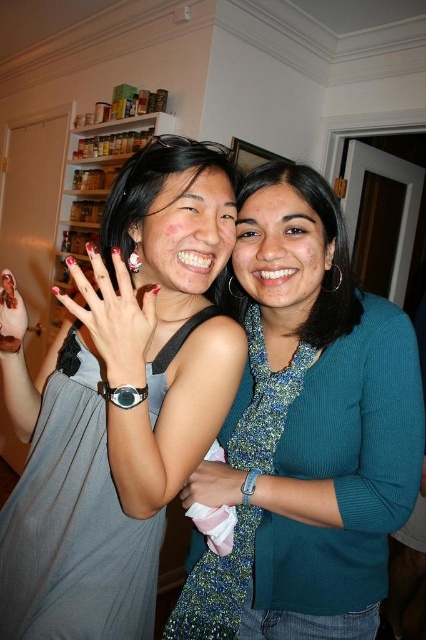
Question: Can you confirm if smooth skin face at center is positioned to the left of blue textured sweater at center?

Choices:
 (A) yes
 (B) no

Answer: (A)

Question: Can you confirm if smooth skin face at center is positioned below matte black face at center?

Choices:
 (A) yes
 (B) no

Answer: (A)

Question: Which object appears closest to the camera in this image?

Choices:
 (A) gray matte dress at center
 (B) matte black face at center
 (C) blue textured sweater at center
 (D) smooth skin face at center

Answer: (A)

Question: Which of the following is the farthest from the observer?

Choices:
 (A) matte black face at center
 (B) smooth skin face at center
 (C) gray matte dress at center
 (D) blue textured sweater at center

Answer: (D)

Question: Based on their relative distances, which object is nearer to the blue textured sweater at center?

Choices:
 (A) smooth skin face at center
 (B) matte black face at center
 (C) gray matte dress at center
 (D) teal ribbed sweater at center

Answer: (A)

Question: Can you confirm if gray matte dress at center is wider than smooth skin face at center?

Choices:
 (A) yes
 (B) no

Answer: (A)